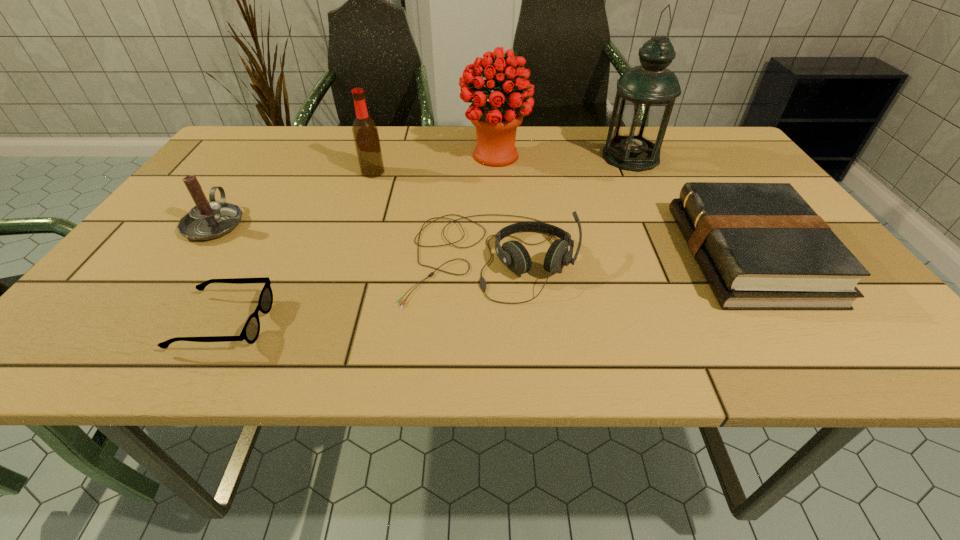
The image size is (960, 540). Find the location of `oil lamp present at the far edge`. oil lamp present at the far edge is located at coordinates (645, 96).

Identify the location of bouquet that is at the far edge. (496, 121).

Identify the location of beer bottle situated at the far edge. (366, 137).

The image size is (960, 540). Find the location of `object that is positioned at the near edge`. object that is positioned at the near edge is located at coordinates (250, 332).

Locate an element on the screen. Image resolution: width=960 pixels, height=540 pixels. object that is at the left edge is located at coordinates (208, 219).

This screenshot has width=960, height=540. I want to click on object at the right edge, so click(760, 246).

Locate an element on the screen. Image resolution: width=960 pixels, height=540 pixels. free location at the far edge is located at coordinates (567, 133).

In the image, there is a desktop. At what (x,y) coordinates should I click in order to perform the action: click on vacant space at the near edge. Please return your answer as a coordinate pair (x, y). Looking at the image, I should click on (604, 361).

This screenshot has width=960, height=540. In the image, there is a desktop. Identify the location of vacant space at the left edge. (190, 252).

In the image, there is a desktop. Where is `vacant space at the far left corner`? vacant space at the far left corner is located at coordinates (216, 161).